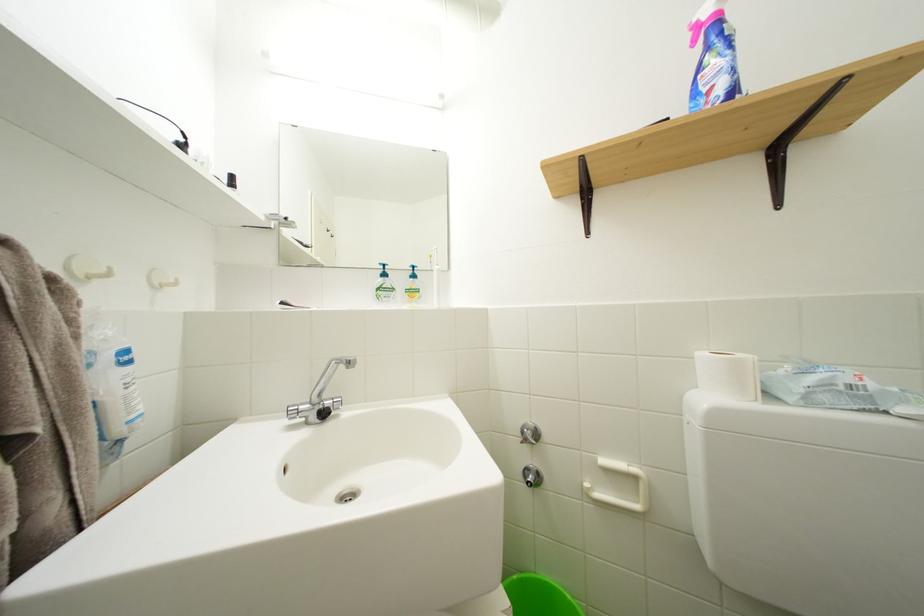
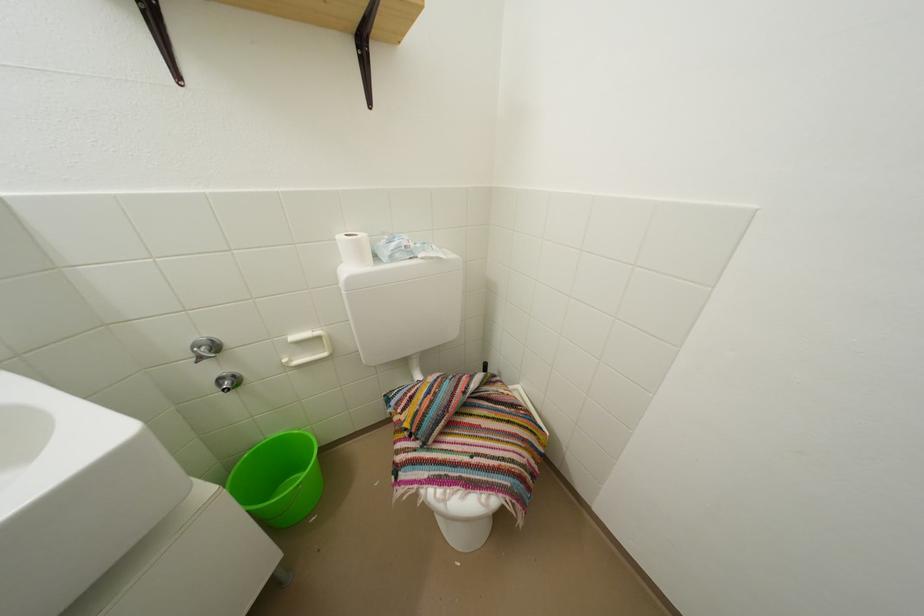
In the second image, find the point that corresponds to (x=707, y=360) in the first image.

(346, 243)